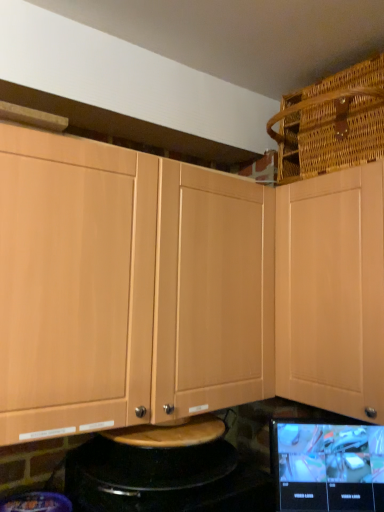
Question: Is matte black tablet at lower right located within light wood cabinet at upper right, positioned as the 1th cabinetry in right-to-left order?

Choices:
 (A) no
 (B) yes

Answer: (A)

Question: Is light wood cabinet at upper right, which ranks as the 2th cabinetry in left-to-right order, facing towards matte black tablet at lower right?

Choices:
 (A) no
 (B) yes

Answer: (A)

Question: Does light wood cabinet at upper right, positioned as the 1th cabinetry in right-to-left order, have a greater width compared to matte black tablet at lower right?

Choices:
 (A) no
 (B) yes

Answer: (B)

Question: Is light wood cabinet at upper right, positioned as the 1th cabinetry in right-to-left order, to the right of matte black tablet at lower right from the viewer's perspective?

Choices:
 (A) yes
 (B) no

Answer: (A)

Question: Is light wood cabinet at upper right, positioned as the 1th cabinetry in right-to-left order, positioned far away from matte black tablet at lower right?

Choices:
 (A) no
 (B) yes

Answer: (A)

Question: Is light wood cabinet at upper right, which ranks as the 2th cabinetry in left-to-right order, wider or thinner than light wood cabinet at upper left, which appears as the 2th cabinetry when viewed from the right?

Choices:
 (A) wide
 (B) thin

Answer: (A)

Question: From a real-world perspective, is light wood cabinet at upper right, positioned as the 1th cabinetry in right-to-left order, physically located above or below light wood cabinet at upper left, placed as the 1th cabinetry when sorted from left to right?

Choices:
 (A) below
 (B) above

Answer: (B)

Question: From the image's perspective, relative to light wood cabinet at upper left, placed as the 1th cabinetry when sorted from left to right, is light wood cabinet at upper right, positioned as the 1th cabinetry in right-to-left order, above or below?

Choices:
 (A) above
 (B) below

Answer: (B)

Question: Do you think light wood cabinet at upper right, positioned as the 1th cabinetry in right-to-left order, is within light wood cabinet at upper left, which appears as the 2th cabinetry when viewed from the right, or outside of it?

Choices:
 (A) inside
 (B) outside

Answer: (B)

Question: Is light wood cabinet at upper left, which appears as the 2th cabinetry when viewed from the right, to the left or to the right of matte black tablet at lower right in the image?

Choices:
 (A) left
 (B) right

Answer: (A)

Question: From a real-world perspective, relative to matte black tablet at lower right, is light wood cabinet at upper left, placed as the 1th cabinetry when sorted from left to right, vertically above or below?

Choices:
 (A) above
 (B) below

Answer: (A)

Question: Considering their positions, is light wood cabinet at upper left, which appears as the 2th cabinetry when viewed from the right, located in front of or behind matte black tablet at lower right?

Choices:
 (A) front
 (B) behind

Answer: (A)

Question: Is point (289, 356) closer or farther from the camera than point (306, 443)?

Choices:
 (A) closer
 (B) farther

Answer: (B)

Question: Is light wood cabinet at upper left, placed as the 1th cabinetry when sorted from left to right, situated inside woven brown basket at upper right or outside?

Choices:
 (A) outside
 (B) inside

Answer: (A)

Question: Is light wood cabinet at upper left, placed as the 1th cabinetry when sorted from left to right, bigger or smaller than woven brown basket at upper right?

Choices:
 (A) big
 (B) small

Answer: (A)